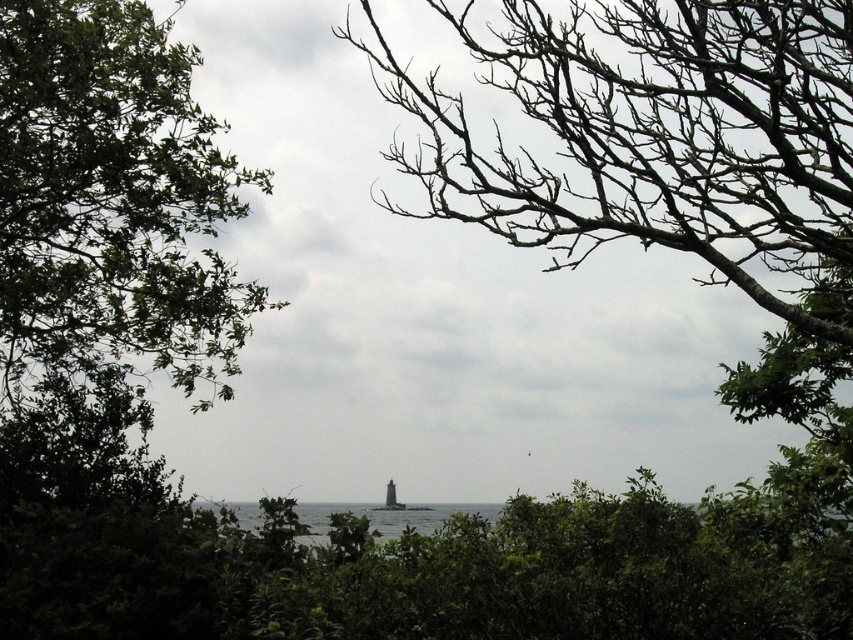
Does brown bark tree at center have a greater height compared to transparent water at center?

Indeed, brown bark tree at center has a greater height compared to transparent water at center.

Does point (630, 129) lie behind point (802, 525)?

That is False.

You are a GUI agent. You are given a task and a screenshot of the screen. Output one action in this format:
    pyautogui.click(x=<x>, y=<y>)
    Task: Click on the brown bark tree at center
    The image size is (853, 640).
    Given the screenshot: What is the action you would take?
    pyautogui.click(x=656, y=136)

Is point (128, 252) behind point (334, 524)?

Yes, it is behind point (334, 524).

Does green leafy tree at left appear under transparent water at center?

No, green leafy tree at left is not below transparent water at center.

Describe the element at coordinates (112, 198) in the screenshot. I see `green leafy tree at left` at that location.

Where is `green leafy tree at left`? green leafy tree at left is located at coordinates (112, 198).

Can you confirm if brown bark tree at center is bigger than green leafy tree at left?

Yes.

Can you confirm if brown bark tree at center is shorter than green leafy tree at left?

Indeed, brown bark tree at center has a lesser height compared to green leafy tree at left.

Image resolution: width=853 pixels, height=640 pixels. Describe the element at coordinates (656, 136) in the screenshot. I see `brown bark tree at center` at that location.

You are a GUI agent. You are given a task and a screenshot of the screen. Output one action in this format:
    pyautogui.click(x=<x>, y=<y>)
    Task: Click on the brown bark tree at center
    The height and width of the screenshot is (640, 853).
    Given the screenshot: What is the action you would take?
    pyautogui.click(x=656, y=136)